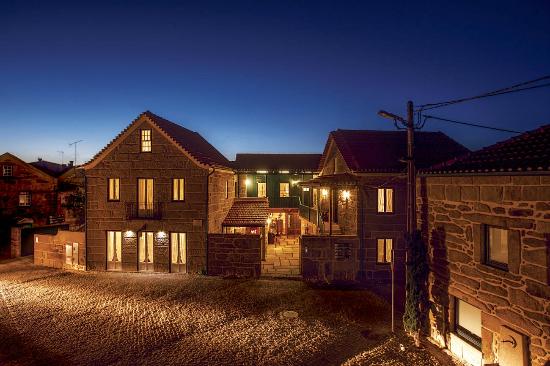
Find the location of a particular element. This screenshot has width=550, height=366. wall closest to front of image is located at coordinates (533, 310).